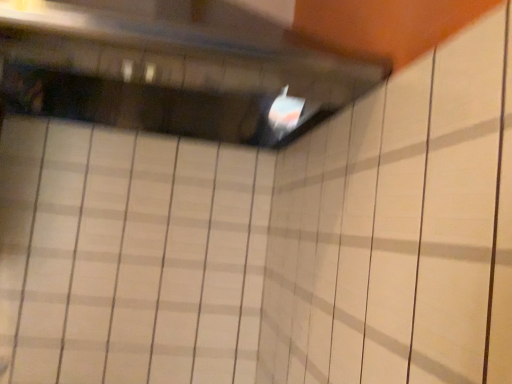
The image size is (512, 384). What do you see at coordinates (170, 68) in the screenshot?
I see `metallic silver window at upper center` at bounding box center [170, 68].

Identify the location of metallic silver window at upper center. This screenshot has width=512, height=384. (170, 68).

Where is `metallic silver window at upper center`? This screenshot has height=384, width=512. metallic silver window at upper center is located at coordinates (170, 68).